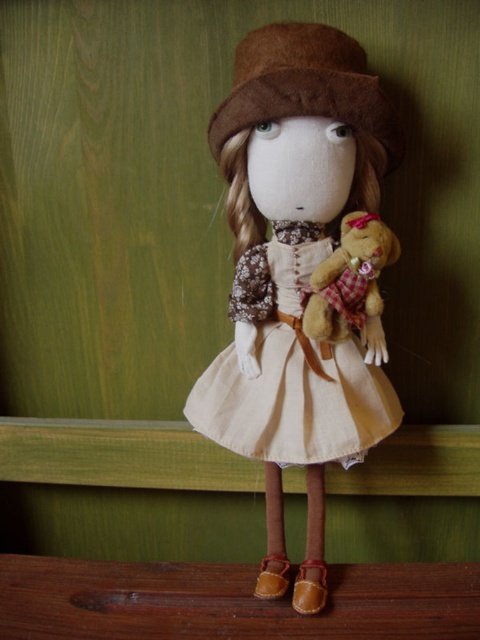
Is point (243, 337) behind point (384, 145)?

That is True.

Does matte brown fabric doll at center have a greater height compared to brown felt hat at center?

Yes.

Does point (268, 124) lie in front of point (331, 93)?

No, it is not.

Locate an element on the screen. matte brown fabric doll at center is located at coordinates tap(296, 275).

Describe the element at coordinates (307, 88) in the screenshot. This screenshot has width=480, height=640. I see `brown felt hat at center` at that location.

Who is more forward, (241, 38) or (363, 252)?

Positioned in front is point (363, 252).

Is point (342, 52) positioned in front of point (323, 291)?

Yes, point (342, 52) is in front of point (323, 291).

At what (x,y) coordinates should I click in order to perform the action: click on brown felt hat at center. Please return your answer as a coordinate pair (x, y). The image size is (480, 640). Looking at the image, I should click on (307, 88).

Which of these two, beige cotton dress at center or brown felt hat at center, stands taller?

beige cotton dress at center

Is point (321, 394) positioned after point (259, 40)?

Yes.

You are a GUI agent. You are given a task and a screenshot of the screen. Output one action in this format:
    pyautogui.click(x=<x>, y=<y>)
    Task: Click on the beige cotton dress at center
    This screenshot has height=640, width=480.
    Given the screenshot: What is the action you would take?
    pyautogui.click(x=294, y=403)